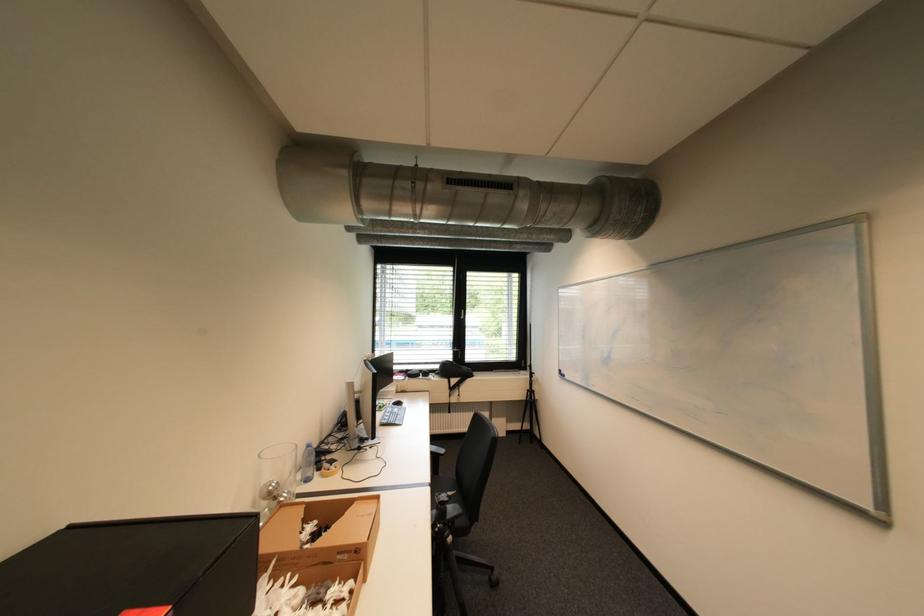
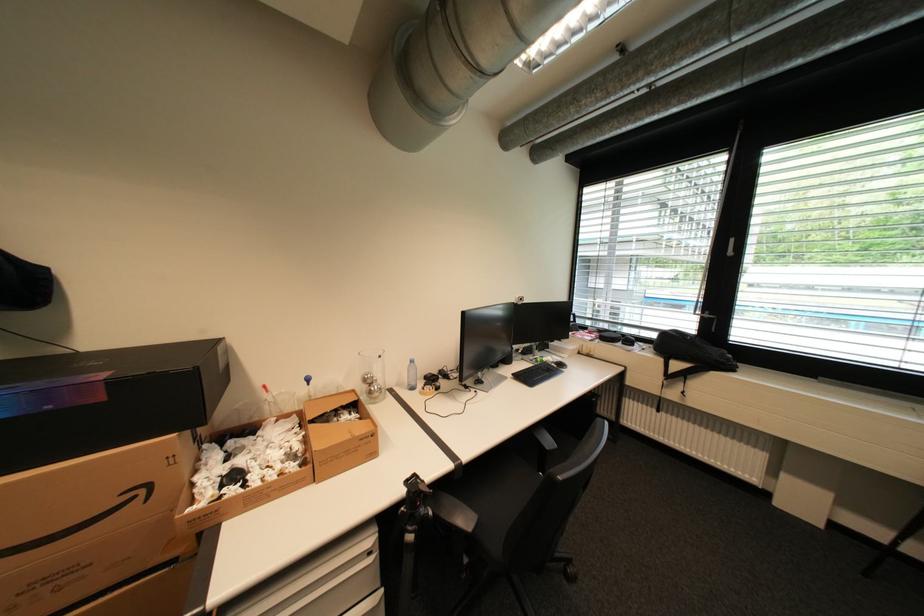
Find the pixel in the second image that matches (282,487) in the first image.

(377, 378)